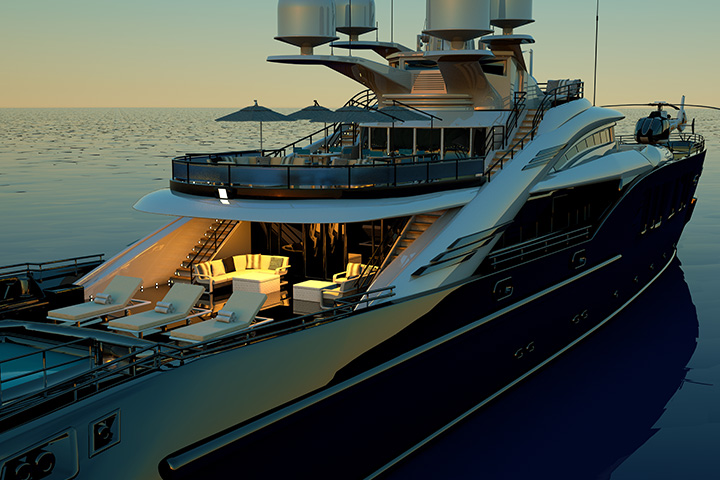
Where is `sofas`? The height and width of the screenshot is (480, 720). sofas is located at coordinates (219, 275), (350, 269), (554, 83).